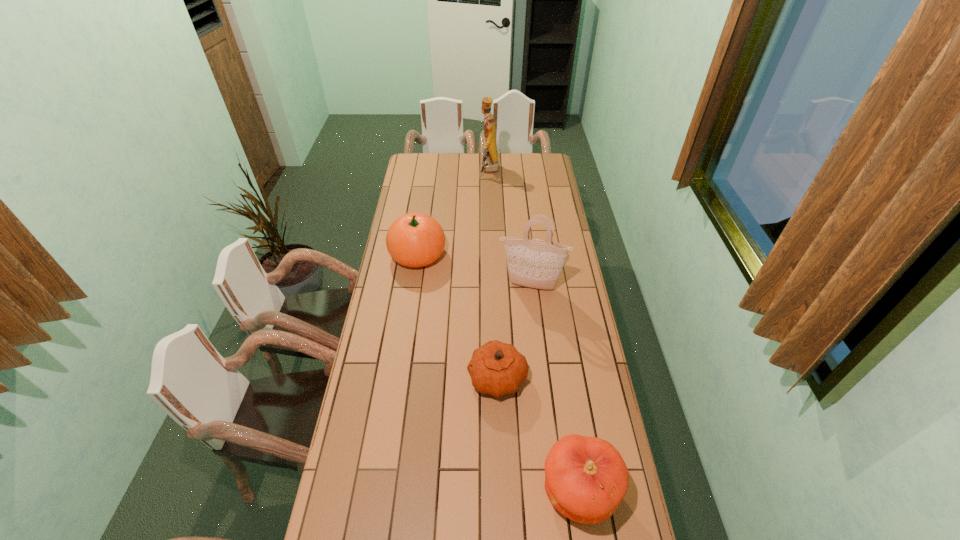
Locate an element on the screen. vacant position located 0.400m on the front-facing side of the nutcracker is located at coordinates (410, 171).

The height and width of the screenshot is (540, 960). What are the coordinates of `free location located on the front of the shopping bag` in the screenshot? It's located at (540, 363).

Identify the location of blank space located on the front of the fourth nearest object. The height and width of the screenshot is (540, 960). (405, 339).

At what (x,y) coordinates should I click in order to perform the action: click on free space located 0.200m on the left of the nearest pumpkin. Please return your answer as a coordinate pair (x, y). The width and height of the screenshot is (960, 540). Looking at the image, I should click on (473, 491).

You are a GUI agent. You are given a task and a screenshot of the screen. Output one action in this format:
    pyautogui.click(x=<x>, y=<y>)
    Task: Click on the free point located 0.160m on the front-facing side of the shortest object
    This screenshot has height=540, width=960.
    Given the screenshot: What is the action you would take?
    pyautogui.click(x=423, y=378)

I want to click on vacant space positioned on the front-facing side of the shortest object, so click(423, 378).

You are a GUI agent. You are given a task and a screenshot of the screen. Output one action in this format:
    pyautogui.click(x=<x>, y=<y>)
    Task: Click on the blank area located on the front-facing side of the shortest object
    This screenshot has height=540, width=960.
    Given the screenshot: What is the action you would take?
    pyautogui.click(x=406, y=378)

This screenshot has width=960, height=540. I want to click on object at the far edge, so click(x=490, y=163).

Identify the location of object present at the left edge. (415, 239).

Find the location of a particular element. This screenshot has height=540, width=960. shopping bag that is at the right edge is located at coordinates (533, 263).